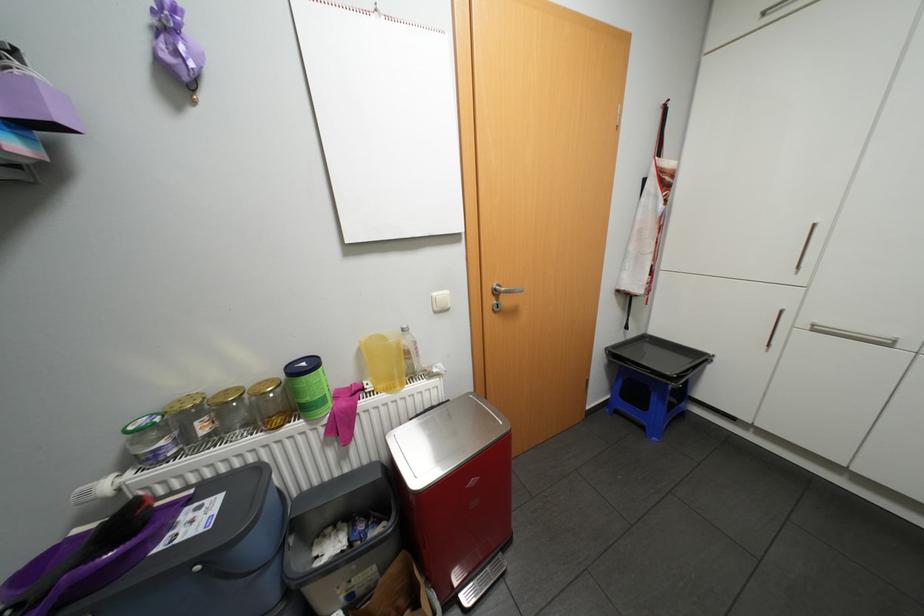
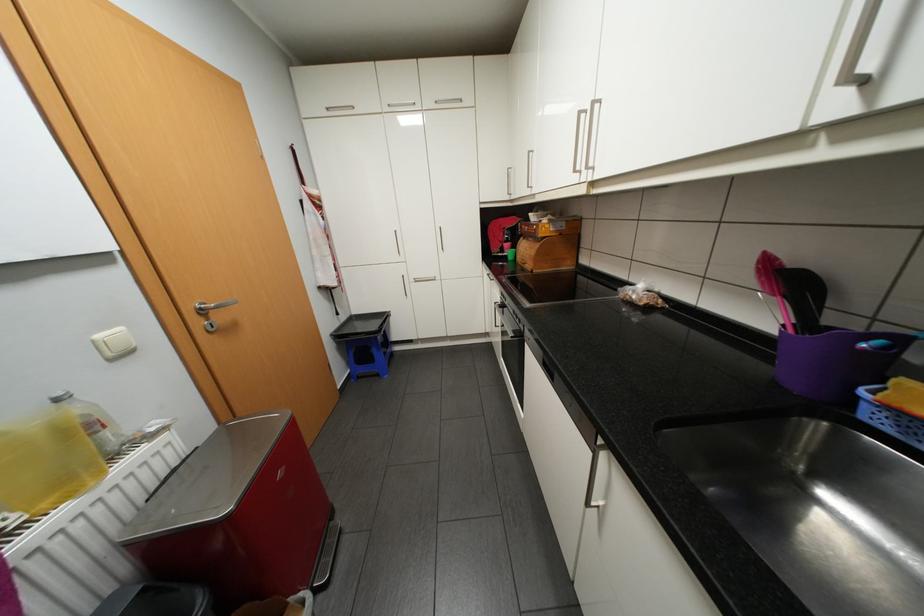
In the second image, find the point that corresponds to the point at 388,386 in the first image.

(53, 504)